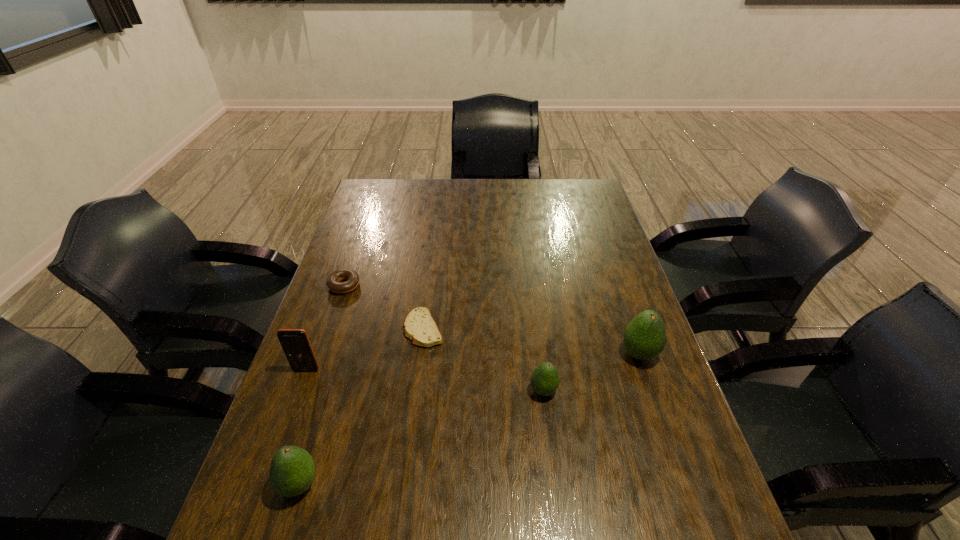
The height and width of the screenshot is (540, 960). I want to click on free space for an extra avocado to achieve even spacing, so click(x=432, y=433).